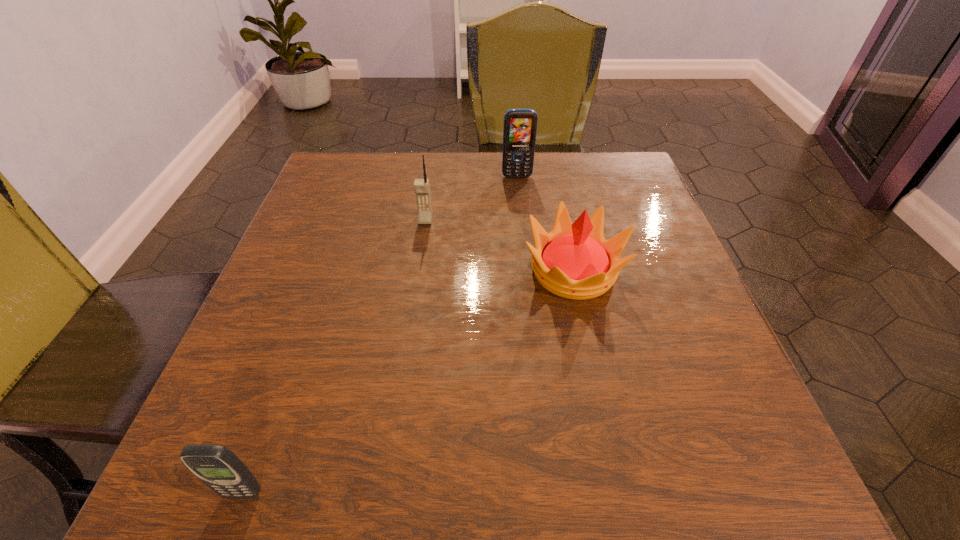
Find the location of a particular element. vacant area at the near left corner is located at coordinates (257, 437).

Identify the location of free space at the far right corner of the desktop. The image size is (960, 540). (622, 177).

Find the location of a particular element. free space at the near right corner of the desktop is located at coordinates (749, 455).

The image size is (960, 540). I want to click on vacant space in between the shortest cellular telephone and the farthest cellular telephone, so click(x=380, y=335).

You are a GUI agent. You are given a task and a screenshot of the screen. Output one action in this format:
    pyautogui.click(x=<x>, y=<y>)
    Task: Click on the vacant space that's between the nearest object and the second nearest object
    
    Given the screenshot: What is the action you would take?
    pyautogui.click(x=408, y=382)

Find the location of a particular element. This screenshot has width=960, height=540. empty space between the farthest cellular telephone and the second nearest object is located at coordinates (545, 224).

I want to click on blank region between the crown and the farthest object, so click(x=545, y=224).

The width and height of the screenshot is (960, 540). Identify the location of unoccupied area between the rightmost cellular telephone and the crown. (545, 224).

At what (x,y) coordinates should I click in order to perform the action: click on vacant space in between the nearest cellular telephone and the farthest cellular telephone. Please return your answer as a coordinate pair (x, y). Looking at the image, I should click on [380, 335].

Where is `blank region between the farthest object and the shortest cellular telephone`? Image resolution: width=960 pixels, height=540 pixels. blank region between the farthest object and the shortest cellular telephone is located at coordinates (380, 335).